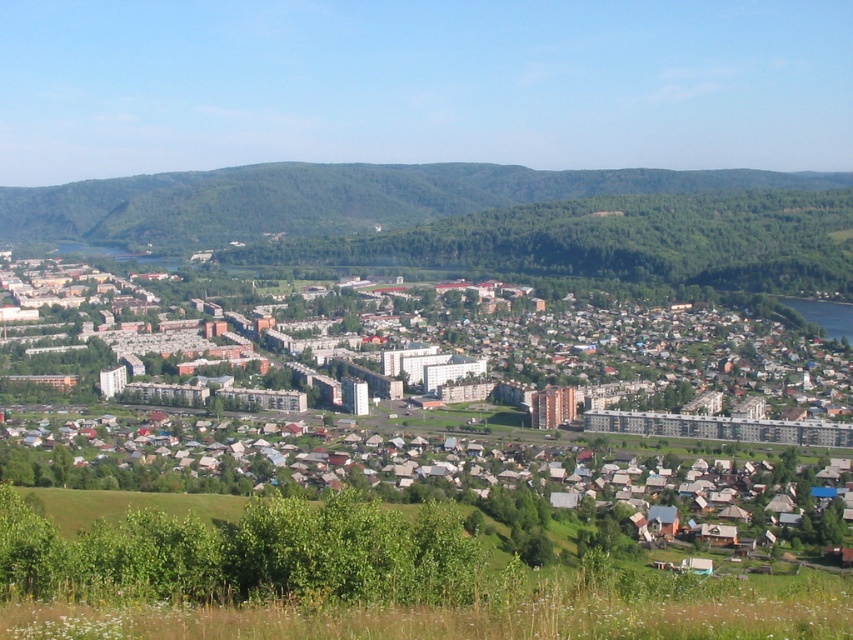
Question: Considering the relative positions of multicolored residential buildings at center and green forested mountain at upper center in the image provided, where is multicolored residential buildings at center located with respect to green forested mountain at upper center?

Choices:
 (A) left
 (B) right

Answer: (A)

Question: Which of the following is the closest to the observer?

Choices:
 (A) (309, 449)
 (B) (532, 195)

Answer: (A)

Question: Does multicolored residential buildings at center appear on the left side of green forested mountain at upper center?

Choices:
 (A) yes
 (B) no

Answer: (A)

Question: Is multicolored residential buildings at center further to the viewer compared to green forested mountain at upper center?

Choices:
 (A) no
 (B) yes

Answer: (A)